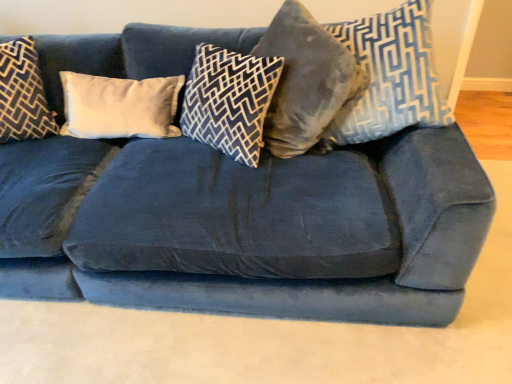
Question: Should I look upward or downward to see velvet gray pillow at center, which ranks as the fourth pillow in left-to-right order?

Choices:
 (A) down
 (B) up

Answer: (B)

Question: Is velvet blue pillow at upper right, the fifth pillow when ordered from left to right, smaller than velvet gray pillow at center, which ranks as the fourth pillow in left-to-right order?

Choices:
 (A) no
 (B) yes

Answer: (B)

Question: Does velvet blue pillow at upper right, the fifth pillow when ordered from left to right, come behind velvet gray pillow at center, marked as the 2th pillow in a right-to-left arrangement?

Choices:
 (A) no
 (B) yes

Answer: (A)

Question: Does velvet blue pillow at upper right, the fifth pillow when ordered from left to right, have a greater width compared to velvet gray pillow at center, marked as the 2th pillow in a right-to-left arrangement?

Choices:
 (A) no
 (B) yes

Answer: (B)

Question: Does velvet blue pillow at upper right, the fifth pillow when ordered from left to right, appear on the right side of velvet gray pillow at center, which ranks as the fourth pillow in left-to-right order?

Choices:
 (A) yes
 (B) no

Answer: (A)

Question: Is velvet blue pillow at upper right, which appears as the first pillow when viewed from the right, positioned with its back to velvet gray pillow at center, which ranks as the fourth pillow in left-to-right order?

Choices:
 (A) no
 (B) yes

Answer: (A)

Question: Is velvet blue pillow at upper right, the fifth pillow when ordered from left to right, placed right next to velvet gray pillow at center, marked as the 2th pillow in a right-to-left arrangement?

Choices:
 (A) no
 (B) yes

Answer: (A)

Question: Is dark blue velvet pillow at left, the 5th pillow in the right-to-left sequence, facing away from white velvet pillow at center, the 2th pillow from the left?

Choices:
 (A) no
 (B) yes

Answer: (A)

Question: Does dark blue velvet pillow at left, which appears as the first pillow when viewed from the left, come behind white velvet pillow at center, which is counted as the fourth pillow, starting from the right?

Choices:
 (A) yes
 (B) no

Answer: (B)

Question: Is white velvet pillow at center, which is counted as the fourth pillow, starting from the right, a part of dark blue velvet pillow at left, which appears as the first pillow when viewed from the left?

Choices:
 (A) no
 (B) yes

Answer: (A)

Question: Is dark blue velvet pillow at left, which appears as the first pillow when viewed from the left, at the right side of white velvet pillow at center, which is counted as the fourth pillow, starting from the right?

Choices:
 (A) yes
 (B) no

Answer: (B)

Question: Considering the relative sizes of dark blue velvet pillow at left, which appears as the first pillow when viewed from the left, and white velvet pillow at center, the 2th pillow from the left, in the image provided, is dark blue velvet pillow at left, which appears as the first pillow when viewed from the left, smaller than white velvet pillow at center, the 2th pillow from the left,?

Choices:
 (A) yes
 (B) no

Answer: (B)

Question: Does dark blue velvet pillow at left, the 5th pillow in the right-to-left sequence, have a greater height compared to white velvet pillow at center, which is counted as the fourth pillow, starting from the right?

Choices:
 (A) no
 (B) yes

Answer: (B)

Question: Is velvet blue pillow at center, the third pillow from the right, at the right side of velvet blue pillow at upper right, the fifth pillow when ordered from left to right?

Choices:
 (A) yes
 (B) no

Answer: (B)